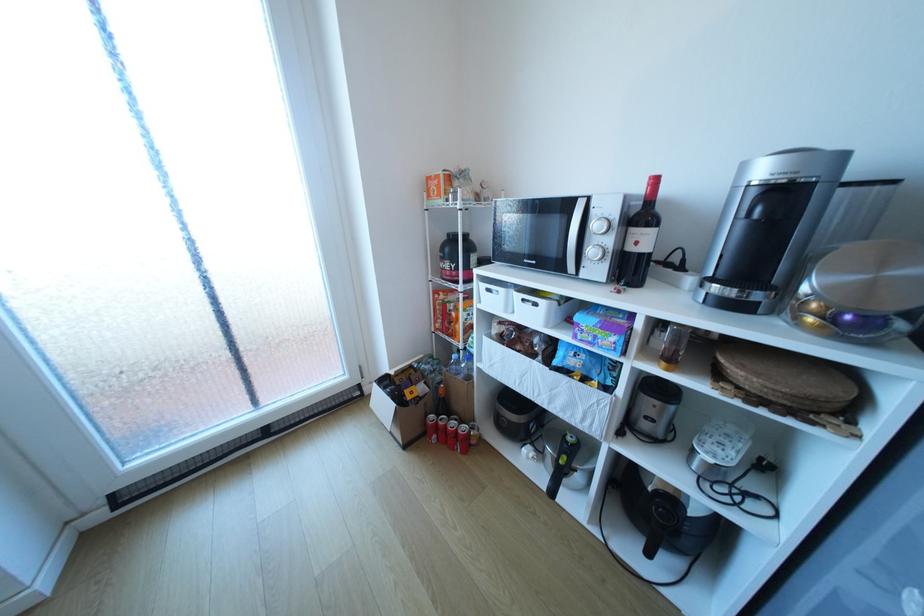
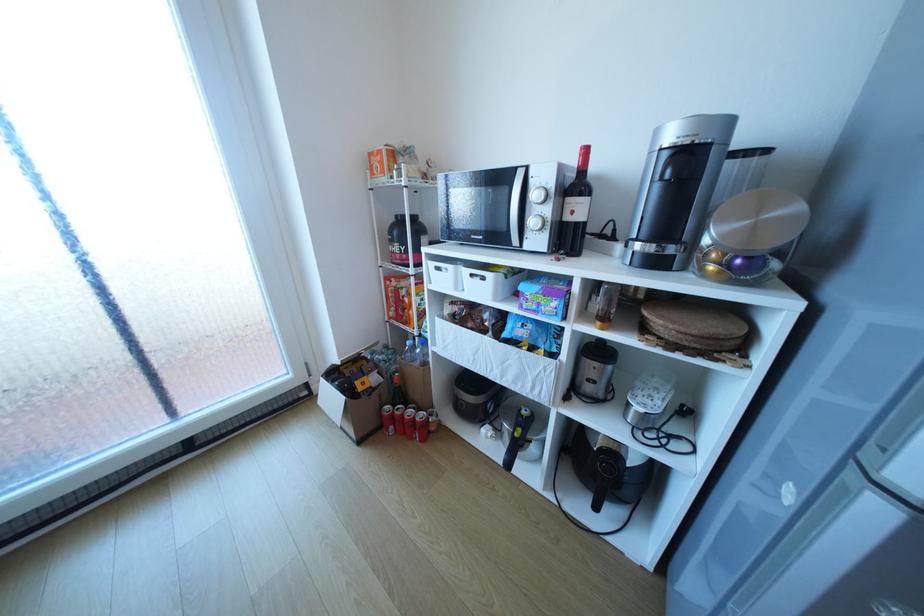
Locate, in the second image, the point that corresponds to pixel 497 290 in the first image.

(446, 268)